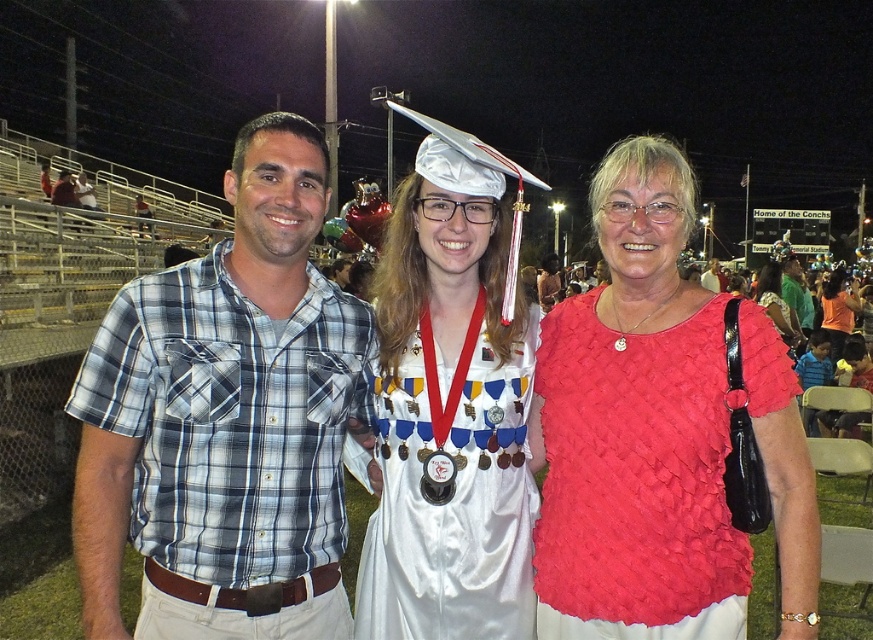
Question: Which of the following is the closest to the observer?

Choices:
 (A) (176, 355)
 (B) (110, 592)
 (C) (835, 353)

Answer: (B)

Question: Which point is closer to the camera taking this photo?

Choices:
 (A) (839, 300)
 (B) (762, 272)
 (C) (473, 534)
 (D) (301, 628)

Answer: (D)

Question: Is red woven blouse at center to the right of white satin gown at center from the viewer's perspective?

Choices:
 (A) no
 (B) yes

Answer: (B)

Question: Can you confirm if plaid shirt at center is bigger than red woven blouse at center?

Choices:
 (A) yes
 (B) no

Answer: (A)

Question: Based on their relative distances, which object is farther from the white satin gown at center?

Choices:
 (A) red woven blouse at center
 (B) orange fabric dress at center
 (C) matte pink blouse at center
 (D) plaid shirt at center

Answer: (B)

Question: Does plaid shirt at center have a greater width compared to orange fabric dress at center?

Choices:
 (A) no
 (B) yes

Answer: (A)